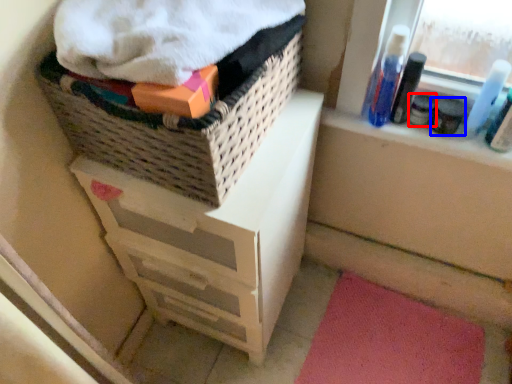
Question: Which object is further to the camera taking this photo, toiletry (highlighted by a red box) or toiletry (highlighted by a blue box)?

Choices:
 (A) toiletry
 (B) toiletry

Answer: (A)